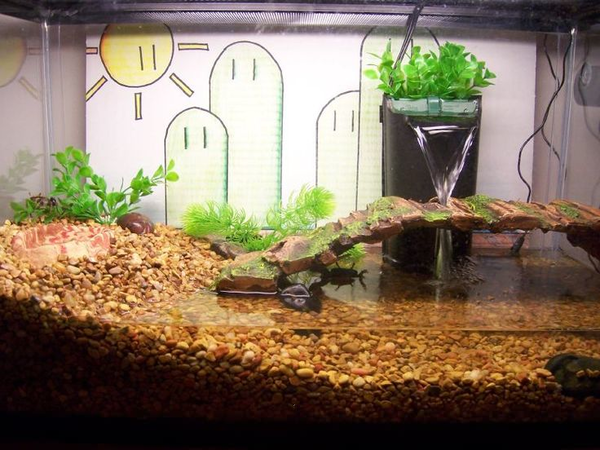
Identify the location of corner of aquarium. Image resolution: width=600 pixels, height=450 pixels. (43, 78), (567, 100).